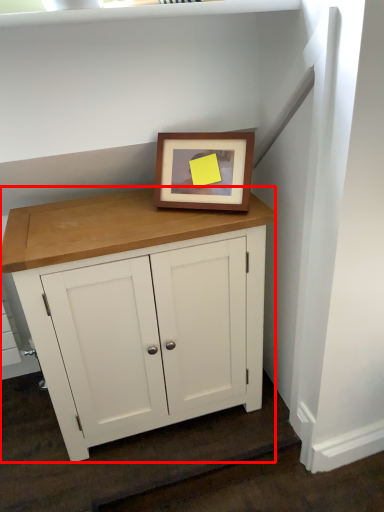
Question: From the image's perspective, where is table (annotated by the red box) located in relation to picture frame in the image?

Choices:
 (A) below
 (B) above

Answer: (A)